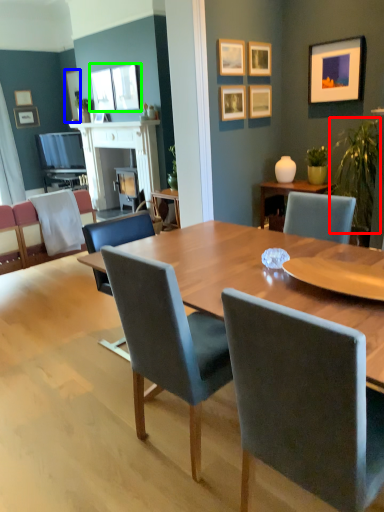
Question: Which is nearer to the plant (highlighted by a red box)? picture frame (highlighted by a blue box) or picture frame (highlighted by a green box).

Choices:
 (A) picture frame
 (B) picture frame

Answer: (B)